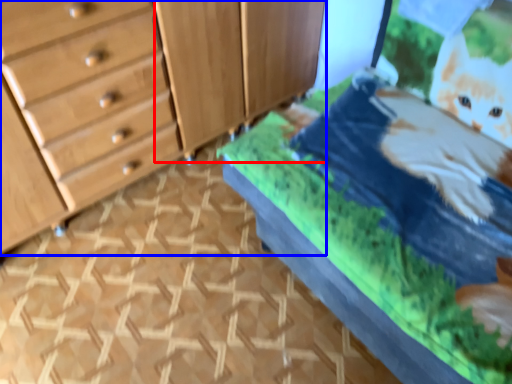
Question: Which point is closer to the camera, cabinetry (highlighted by a red box) or chest of drawers (highlighted by a blue box)?

Choices:
 (A) cabinetry
 (B) chest of drawers

Answer: (B)